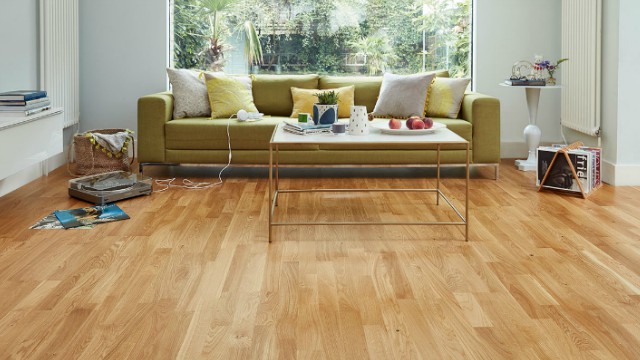
The width and height of the screenshot is (640, 360). What are the coordinates of `books` in the screenshot? It's located at (19, 96), (31, 101), (38, 103), (45, 108).